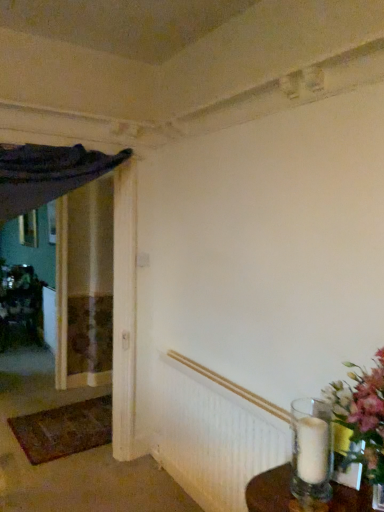
Question: Looking at their shapes, would you say clear glass vase at lower right is wider or thinner than wooden picture frame at left?

Choices:
 (A) thin
 (B) wide

Answer: (B)

Question: From their relative heights in the image, would you say clear glass vase at lower right is taller or shorter than wooden picture frame at left?

Choices:
 (A) tall
 (B) short

Answer: (B)

Question: Estimate the real-world distances between objects in this image. Which object is closer to the clear glass vase at lower right?

Choices:
 (A) white textured radiator at lower right
 (B) brown woven mat at lower left
 (C) metallic silver vase at left
 (D) wooden picture frame at left

Answer: (A)

Question: Which object is the closest to the metallic silver vase at left?

Choices:
 (A) brown woven mat at lower left
 (B) white textured radiator at lower right
 (C) clear glass vase at lower right
 (D) wooden picture frame at left

Answer: (D)